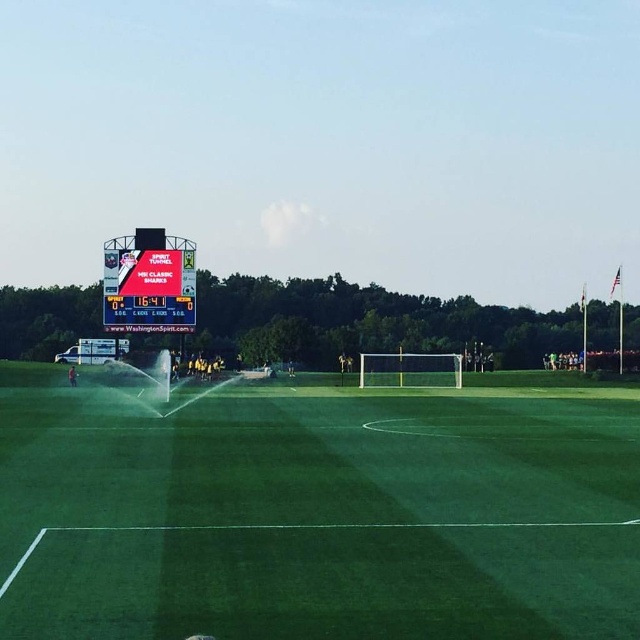
Based on the photo, between green artificial turf at center and white plastic scoreboard at upper left, which one has less height?

green artificial turf at center

Does green artificial turf at center come in front of white plastic scoreboard at upper left?

That is True.

Who is more forward, (273, 515) or (108, 296)?

Positioned in front is point (273, 515).

Locate an element on the screen. Image resolution: width=640 pixels, height=640 pixels. green artificial turf at center is located at coordinates (320, 515).